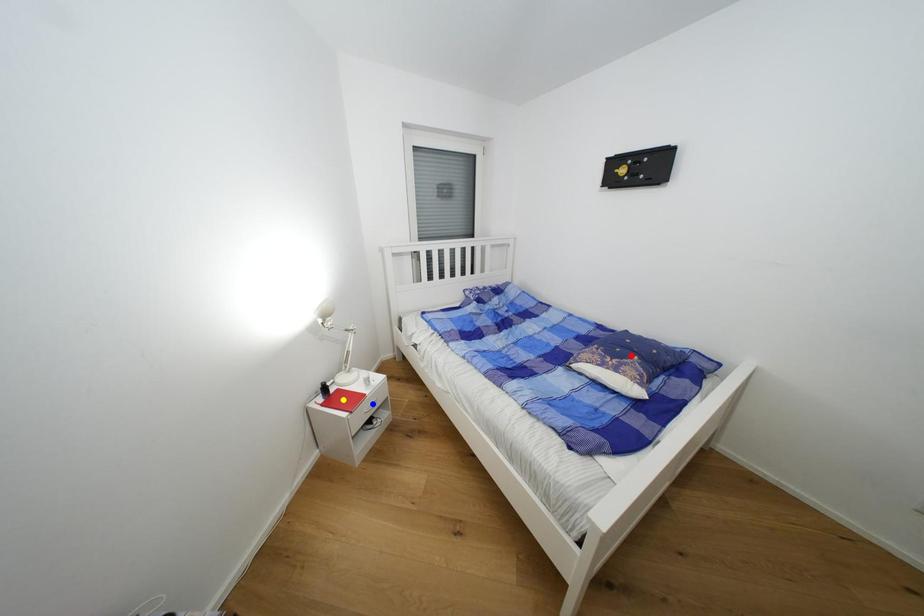
Order these from nearest to farthest:
A) blue point
B) yellow point
C) red point

red point → yellow point → blue point